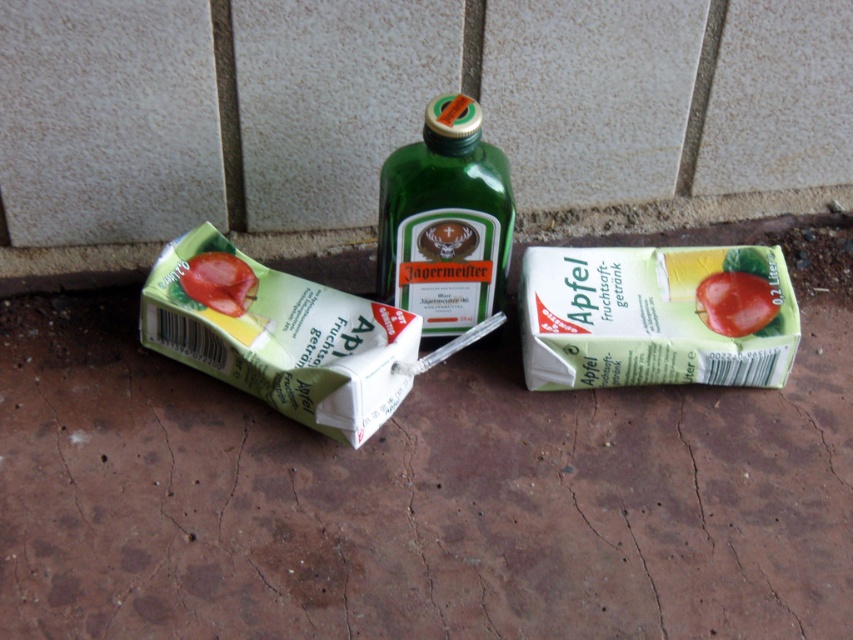
Question: Which object appears farthest from the camera in this image?

Choices:
 (A) green matte carton at center
 (B) green glass bottle at center
 (C) green matte carton at lower left

Answer: (A)

Question: Is green glass bottle at center positioned at the back of glossy red apple at center?

Choices:
 (A) yes
 (B) no

Answer: (B)

Question: Among these objects, which one is farthest from the camera?

Choices:
 (A) glossy red apple at center
 (B) green glass bottle at center
 (C) green matte carton at lower left

Answer: (A)

Question: Is green matte carton at lower left to the right of glossy red apple at center from the viewer's perspective?

Choices:
 (A) no
 (B) yes

Answer: (A)

Question: Can you confirm if glossy red apple at center is positioned below glossy plastic tomato at lower left?

Choices:
 (A) no
 (B) yes

Answer: (B)

Question: Which point appears closest to the camera in this image?

Choices:
 (A) (440, 292)
 (B) (715, 308)
 (C) (274, 396)
 (D) (248, 296)

Answer: (C)